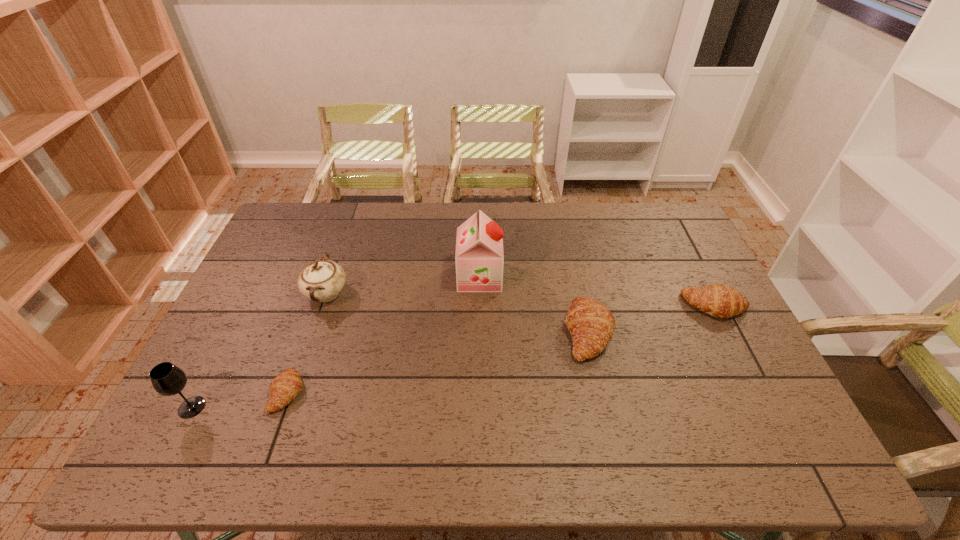
What are the coordinates of `free spot that satisfies the following two spatial constraints: 1. with the cap open on the tallest object; 2. on the back side of the fifth object from left to right` in the screenshot? It's located at (480, 332).

You are a GUI agent. You are given a task and a screenshot of the screen. Output one action in this format:
    pyautogui.click(x=<x>, y=<y>)
    Task: Click on the vacant space that satisfies the following two spatial constraints: 1. with the cap open on the soya milk; 2. on the front side of the wineglass
    
    Given the screenshot: What is the action you would take?
    pyautogui.click(x=479, y=407)

You are a GUI agent. You are given a task and a screenshot of the screen. Output one action in this format:
    pyautogui.click(x=<x>, y=<y>)
    Task: Click on the vacant region that satisfies the following two spatial constraints: 1. with the cap open on the tallest object; 2. on the front side of the leftmost object
    This screenshot has width=960, height=540.
    Given the screenshot: What is the action you would take?
    pyautogui.click(x=479, y=407)